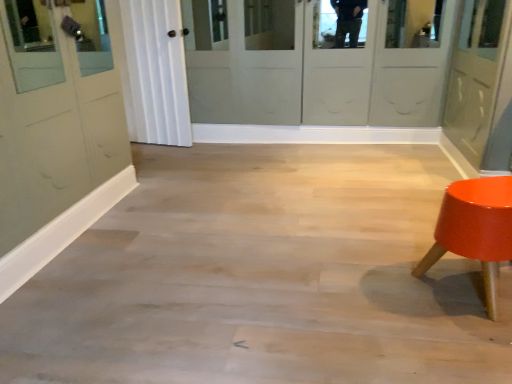
Question: From a real-world perspective, is shiny orange stool at right positioned under matte gray door at right based on gravity?

Choices:
 (A) no
 (B) yes

Answer: (B)

Question: Does shiny orange stool at right have a greater width compared to matte gray door at right?

Choices:
 (A) no
 (B) yes

Answer: (A)

Question: Does shiny orange stool at right lie in front of matte gray door at right?

Choices:
 (A) no
 (B) yes

Answer: (B)

Question: From the image's perspective, does shiny orange stool at right appear lower than matte gray door at right?

Choices:
 (A) no
 (B) yes

Answer: (B)

Question: From the image's perspective, would you say shiny orange stool at right is positioned over matte gray door at right?

Choices:
 (A) no
 (B) yes

Answer: (A)

Question: Can you confirm if shiny orange stool at right is positioned to the right of matte gray door at right?

Choices:
 (A) no
 (B) yes

Answer: (A)

Question: Is matte gray door at right facing towards shiny orange stool at right?

Choices:
 (A) no
 (B) yes

Answer: (A)

Question: Is matte gray door at right taller than shiny orange stool at right?

Choices:
 (A) no
 (B) yes

Answer: (B)

Question: Would you say matte gray door at right is outside shiny orange stool at right?

Choices:
 (A) no
 (B) yes

Answer: (B)

Question: From the image's perspective, is matte gray door at right on shiny orange stool at right?

Choices:
 (A) no
 (B) yes

Answer: (B)

Question: From the image's perspective, would you say matte gray door at right is shown under shiny orange stool at right?

Choices:
 (A) yes
 (B) no

Answer: (B)

Question: Is matte gray door at right positioned behind shiny orange stool at right?

Choices:
 (A) no
 (B) yes

Answer: (B)

Question: From a real-world perspective, is shiny orange stool at right above or below matte gray door at right?

Choices:
 (A) below
 (B) above

Answer: (A)